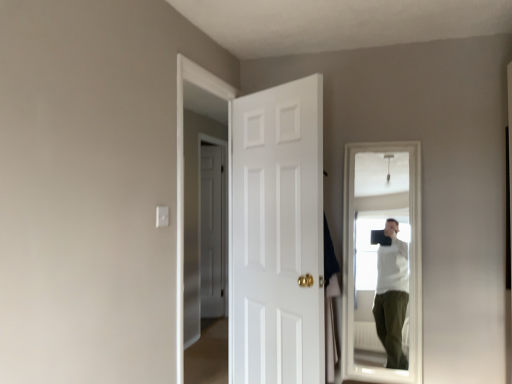
Question: In which direction should I rotate to look at white matte door at center, the 2th door when ordered from front to back?

Choices:
 (A) right
 (B) left

Answer: (B)

Question: Is white painted wood door at center, which is the 2th door in back-to-front order, inside white matte door at center, which is counted as the second door, starting from the right?

Choices:
 (A) no
 (B) yes

Answer: (A)

Question: Can you confirm if white matte door at center, the 1th door viewed from the left, is taller than white painted wood door at center, which is counted as the first door, starting from the front?

Choices:
 (A) yes
 (B) no

Answer: (A)

Question: Would you say white matte door at center, the 2th door when ordered from front to back, is outside white painted wood door at center, which is the 2th door in back-to-front order?

Choices:
 (A) yes
 (B) no

Answer: (A)

Question: Are white matte door at center, the 2th door when ordered from front to back, and white painted wood door at center, which is the 1th door from right to left, located far from each other?

Choices:
 (A) yes
 (B) no

Answer: (A)

Question: Is white matte door at center, the 2th door when ordered from front to back, at the right side of white painted wood door at center, the 2th door in the left-to-right sequence?

Choices:
 (A) yes
 (B) no

Answer: (B)

Question: Does white matte door at center, which is counted as the second door, starting from the right, have a lesser height compared to white painted wood door at center, which is counted as the first door, starting from the front?

Choices:
 (A) no
 (B) yes

Answer: (A)

Question: Is white painted wood door at center, which is counted as the first door, starting from the front, positioned with its back to white matte door at center, which is counted as the second door, starting from the right?

Choices:
 (A) yes
 (B) no

Answer: (B)

Question: Considering the relative sizes of white painted wood door at center, which is the 2th door in back-to-front order, and white matte door at center, the 2th door when ordered from front to back, in the image provided, is white painted wood door at center, which is the 2th door in back-to-front order, smaller than white matte door at center, the 2th door when ordered from front to back,?

Choices:
 (A) no
 (B) yes

Answer: (A)

Question: Is white matte door at center, the 1th door viewed from the left, inside white painted wood door at center, the 2th door in the left-to-right sequence?

Choices:
 (A) no
 (B) yes

Answer: (A)

Question: Is white painted wood door at center, which is counted as the first door, starting from the front, further to the viewer compared to white matte door at center, which is counted as the second door, starting from the right?

Choices:
 (A) no
 (B) yes

Answer: (A)

Question: From a real-world perspective, is white painted wood door at center, the 2th door in the left-to-right sequence, located beneath white matte door at center, which ranks as the first door in back-to-front order?

Choices:
 (A) yes
 (B) no

Answer: (B)

Question: Is white painted wood door at center, the 2th door in the left-to-right sequence, with white matte door at center, the 1th door viewed from the left?

Choices:
 (A) yes
 (B) no

Answer: (B)

Question: Which is correct: white matte door at center, which ranks as the first door in back-to-front order, is inside white painted wood door at center, which is the 1th door from right to left, or outside of it?

Choices:
 (A) outside
 (B) inside

Answer: (A)